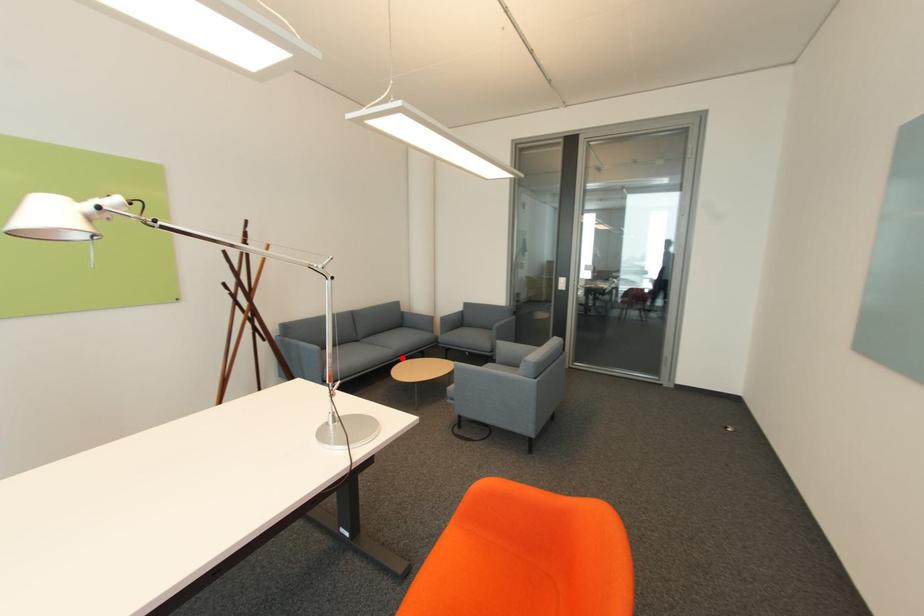
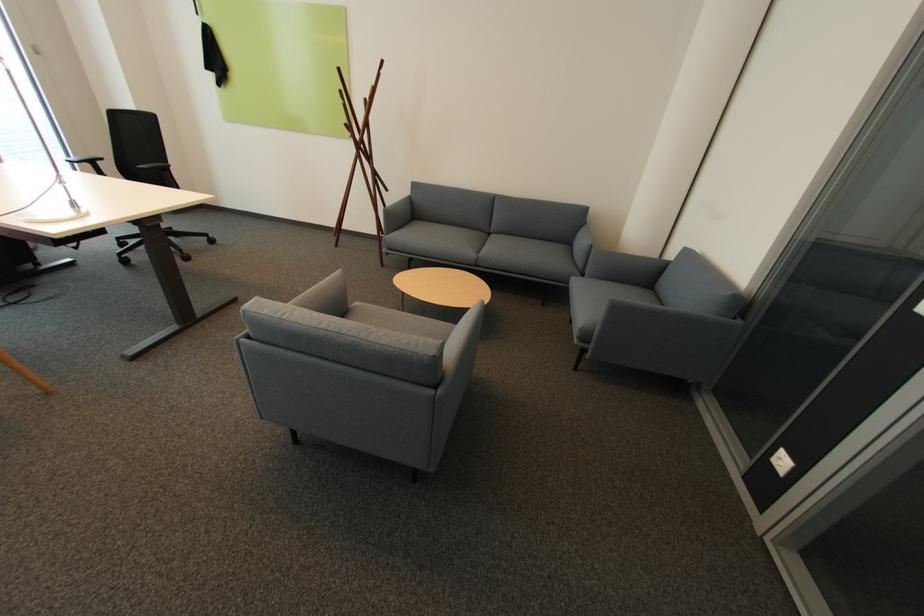
Question: I am providing you with two images of the same scene from different viewpoints. Given a red point in image1, look at the same physical point in image2. Is it:

Choices:
 (A) Closer to the viewpoint
 (B) Farther from the viewpoint

Answer: (B)